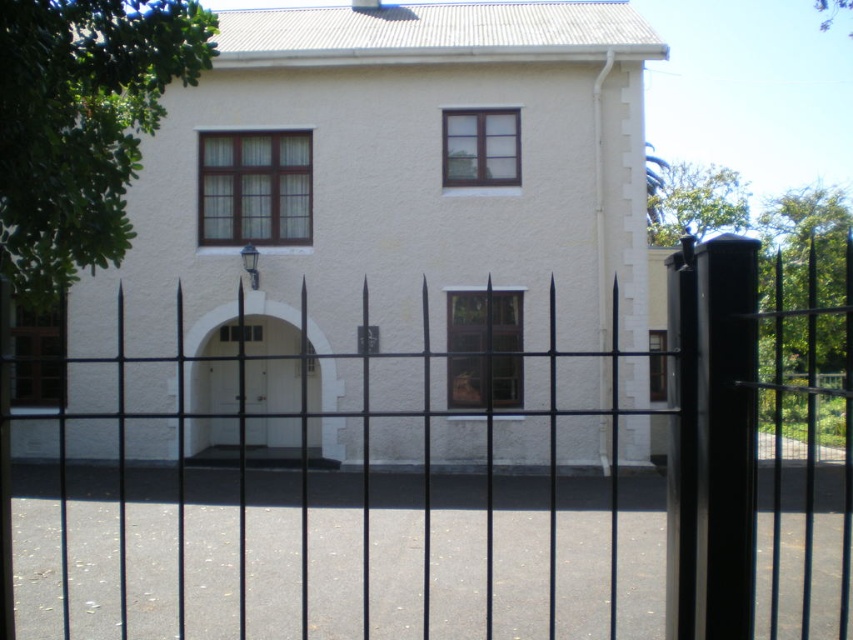
Question: Is black metal fence at center bigger than white matte door at center?

Choices:
 (A) no
 (B) yes

Answer: (B)

Question: Which point is farther from the camera taking this photo?

Choices:
 (A) (221, 410)
 (B) (798, 432)

Answer: (B)

Question: Is black metal fence at center further to camera compared to white matte door at center?

Choices:
 (A) yes
 (B) no

Answer: (B)

Question: Among these points, which one is nearest to the camera?

Choices:
 (A) (239, 385)
 (B) (109, 554)

Answer: (B)

Question: Does black metal fence at center appear over white matte door at center?

Choices:
 (A) yes
 (B) no

Answer: (A)

Question: Which of the following is the farthest from the observer?

Choices:
 (A) [x=223, y=388]
 (B) [x=312, y=518]

Answer: (A)